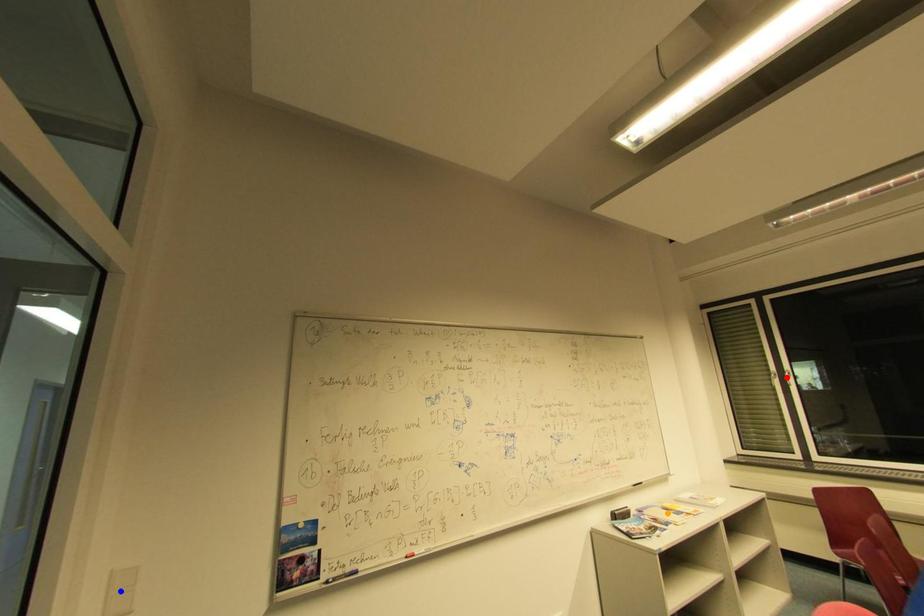
Based on the photo, order these from nearest to farthest:
A) orange point
B) blue point
C) red point

blue point
orange point
red point